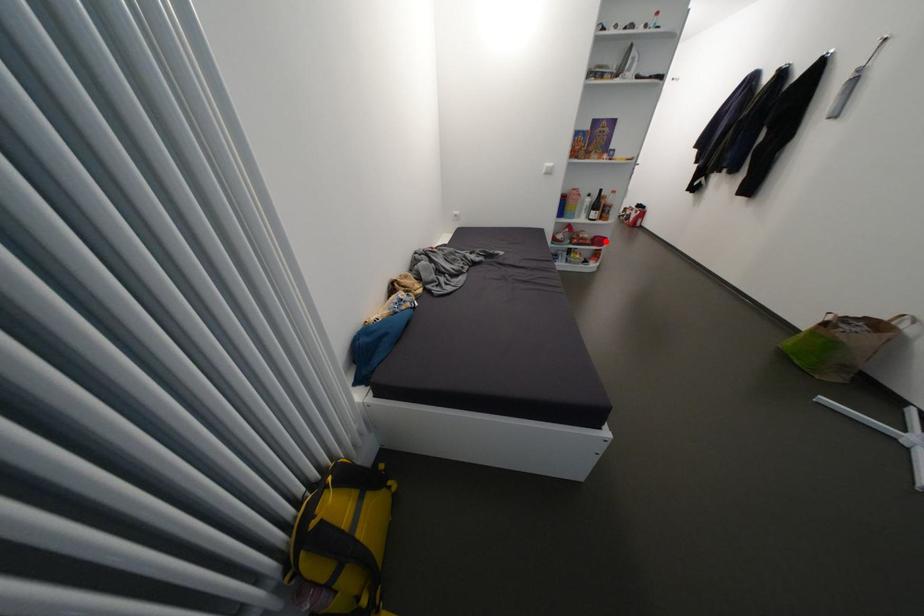
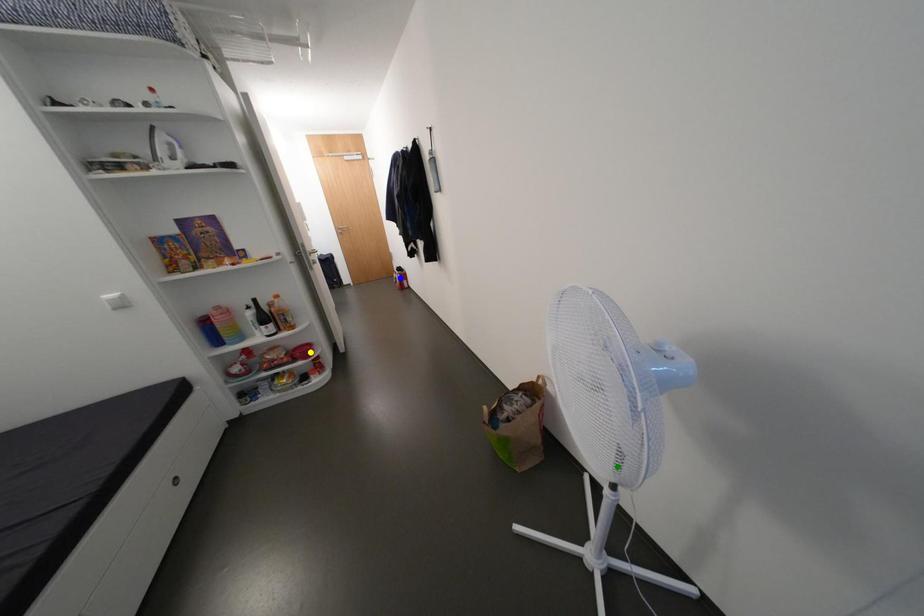
Question: I am providing you with two images of the same scene from different viewpoints. A red point is marked on the first image. You are given multiple points on the second image. Can you choose the point in image 2 that corresponds to the point in image 1?

Choices:
 (A) blue point
 (B) green point
 (C) yellow point

Answer: (C)